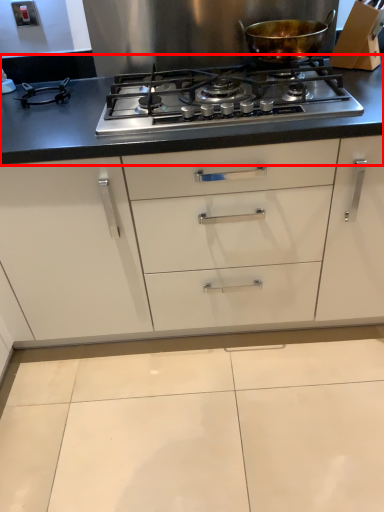
Question: From the image's perspective, where is countertop (annotated by the red box) located relative to kitchen appliance?

Choices:
 (A) below
 (B) above

Answer: (A)